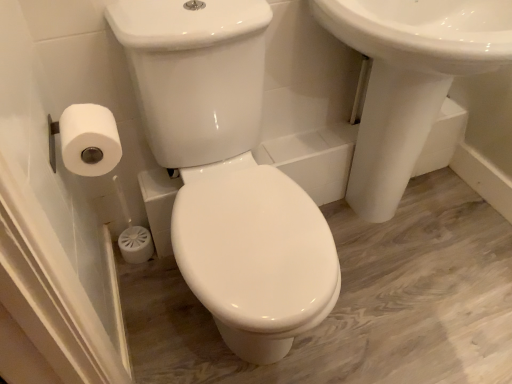
Question: From the image's perspective, is white glossy toilet at center over white matte toilet paper at left?

Choices:
 (A) no
 (B) yes

Answer: (A)

Question: From a real-world perspective, is white glossy toilet at center physically below white matte toilet paper at left?

Choices:
 (A) yes
 (B) no

Answer: (A)

Question: Considering the relative sizes of white glossy toilet at center and white matte toilet paper at left in the image provided, is white glossy toilet at center wider than white matte toilet paper at left?

Choices:
 (A) no
 (B) yes

Answer: (B)

Question: From a real-world perspective, is white glossy toilet at center located higher than white matte toilet paper at left?

Choices:
 (A) no
 (B) yes

Answer: (A)

Question: Considering the relative sizes of white glossy toilet at center and white matte toilet paper at left in the image provided, is white glossy toilet at center bigger than white matte toilet paper at left?

Choices:
 (A) yes
 (B) no

Answer: (A)

Question: In the image, is white glossy sink at upper right positioned in front of or behind white glossy toilet at center?

Choices:
 (A) behind
 (B) front

Answer: (A)

Question: From the image's perspective, is white glossy sink at upper right above or below white glossy toilet at center?

Choices:
 (A) above
 (B) below

Answer: (A)

Question: Does point click(384, 61) appear closer or farther from the camera than point click(136, 28)?

Choices:
 (A) closer
 (B) farther

Answer: (B)

Question: Considering the positions of white glossy sink at upper right and white glossy toilet at center in the image, is white glossy sink at upper right wider or thinner than white glossy toilet at center?

Choices:
 (A) wide
 (B) thin

Answer: (B)

Question: Is point (170, 92) closer or farther from the camera than point (438, 102)?

Choices:
 (A) closer
 (B) farther

Answer: (A)

Question: Choose the correct answer: Is white glossy toilet at center inside white glossy sink at upper right or outside it?

Choices:
 (A) inside
 (B) outside

Answer: (B)

Question: Relative to white glossy sink at upper right, is white glossy toilet at center in front or behind?

Choices:
 (A) front
 (B) behind

Answer: (A)

Question: From a real-world perspective, is white glossy toilet at center positioned above or below white glossy sink at upper right?

Choices:
 (A) above
 (B) below

Answer: (B)

Question: From a real-world perspective, is white matte toilet paper at left positioned above or below white glossy toilet at center?

Choices:
 (A) above
 (B) below

Answer: (A)

Question: Is white matte toilet paper at left spatially inside white glossy toilet at center, or outside of it?

Choices:
 (A) inside
 (B) outside

Answer: (B)